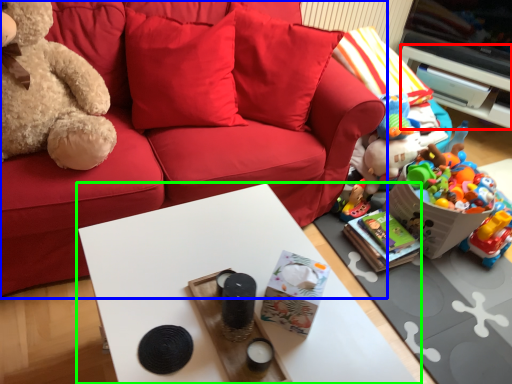
Question: Which is farther away from cabinetry (highlighted by a red box)? studio couch (highlighted by a blue box) or table (highlighted by a green box)?

Choices:
 (A) studio couch
 (B) table

Answer: (B)